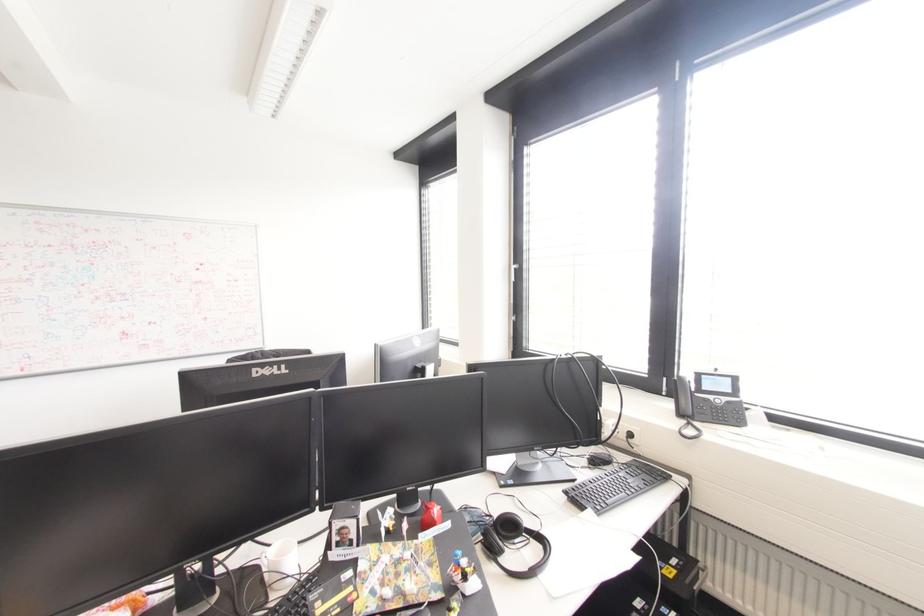
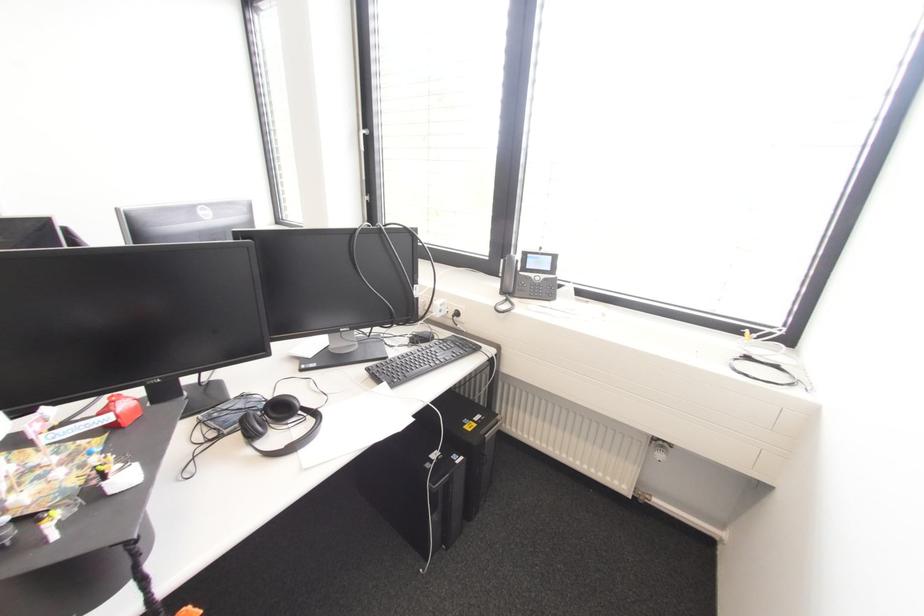
Locate, in the second image, the point that corresponds to the point at 580,506 in the first image.

(379, 381)